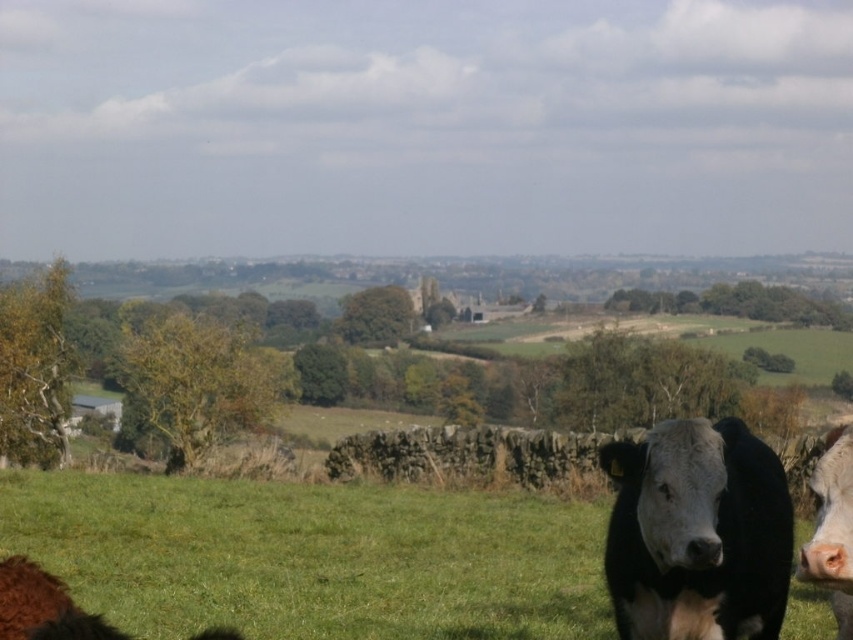
You are standing at the center of the image and want to locate the point marked at coordinates (833,525). Based on the scene description, where exactly would this point be located?

The point marked at coordinates (833,525) is on the black smooth cow at lower right.

You are a photographer positioned at the center of the field. You want to take a photo of the black smooth cow at right without the brown fuzzy bull at lower left appearing in the frame. Is the bull currently blocking the view of the cow?

The brown fuzzy bull at lower left is behind the black smooth cow at right, so it is not blocking the view. You can take the photo without the bull appearing in the frame.